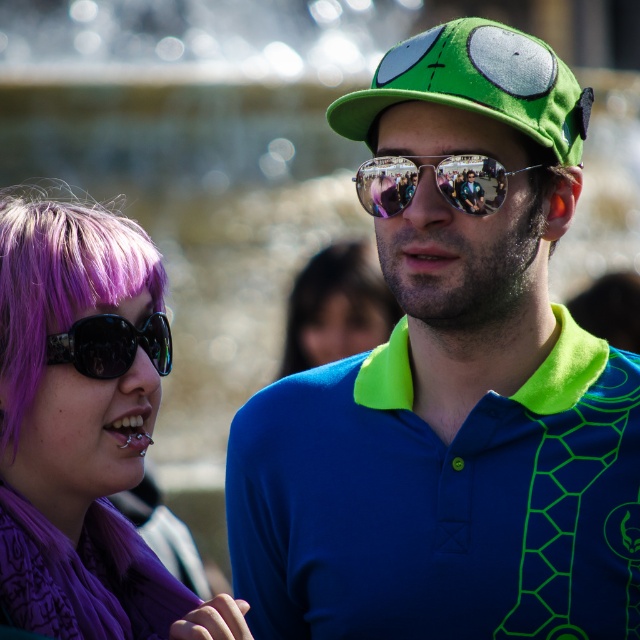
You are standing at the center of the scene. Which of the two points, point [342,272] or point [106,330], is closer to your current position?

Point [106,330] is closer to your current position because it is in front of point [342,272].

From the picture: You are a photographer trying to capture a clear shot of the reflective plastic goggles at center. However, the purple fabric scarf at left is blocking your view. Can you adjust your position to see the goggles without moving the objects?

The purple fabric scarf at left is in front of the reflective plastic goggles at center, so moving slightly to the side might allow you to see around the scarf and capture the goggles.

Consider the image. You are standing at the point (100,419) and want to reach the person with the bright green cap with large cartoonish eyes and a small bow on the side. Given that the distance between you and the person is 64.38 meters, how many steps would you need to take if each step covers 0.7 meters?

The distance between you and the person with the bright green cap with large cartoonish eyes and a small bow on the side is 64.38 meters. Each step covers 0.7 meters. To find the number of steps required, divide the total distance by the step length. 64.38 divided by 0.7 equals approximately 91.97 steps. Since you can only take whole steps, you would need to take 92 steps to reach them.